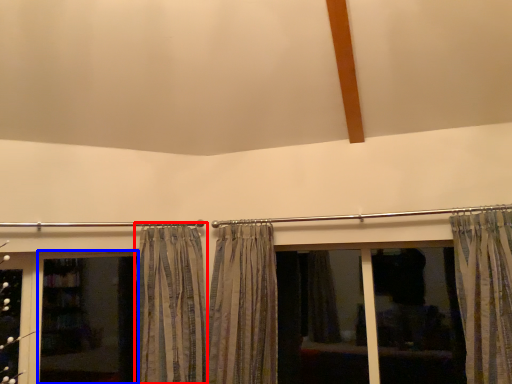
Question: Among these objects, which one is nearest to the camera, curtain (highlighted by a red box) or screen door (highlighted by a blue box)?

Choices:
 (A) curtain
 (B) screen door

Answer: (A)